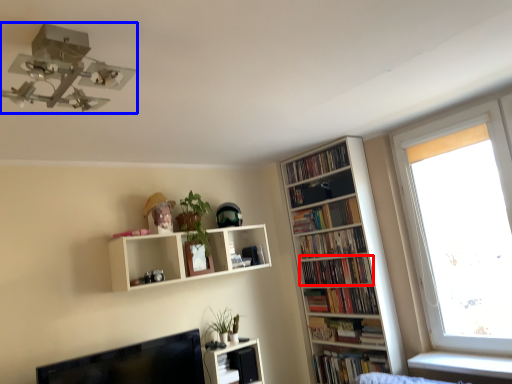
Question: Which point is further to the camera, book (highlighted by a red box) or light fixture (highlighted by a blue box)?

Choices:
 (A) book
 (B) light fixture

Answer: (A)